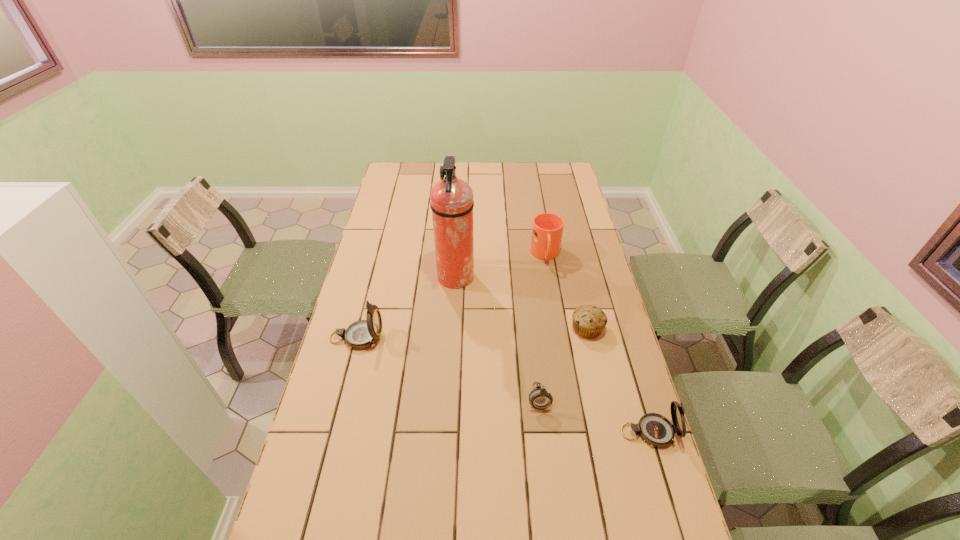
This screenshot has height=540, width=960. In the image, there is a desktop. Identify the location of vacant space at the left edge. (365, 250).

This screenshot has width=960, height=540. I want to click on vacant space at the right edge of the desktop, so click(571, 199).

This screenshot has height=540, width=960. Find the location of `free space at the far left corner of the desktop`. free space at the far left corner of the desktop is located at coordinates (397, 174).

At what (x,y) coordinates should I click in order to perform the action: click on vacant space at the far right corner of the desktop. Please return your answer as a coordinate pair (x, y). Image resolution: width=960 pixels, height=540 pixels. Looking at the image, I should click on (559, 172).

Image resolution: width=960 pixels, height=540 pixels. I want to click on blank region between the fifth object from right to left and the second nearest object, so click(x=497, y=338).

The width and height of the screenshot is (960, 540). In order to click on free space between the fire extinguisher and the second shortest compass in this screenshot , I will do `click(552, 355)`.

Where is `free spot between the muffin and the second shortest compass`? The image size is (960, 540). free spot between the muffin and the second shortest compass is located at coordinates (618, 380).

Where is `vacant space in between the leftmost object and the muffin`? vacant space in between the leftmost object and the muffin is located at coordinates (472, 333).

Image resolution: width=960 pixels, height=540 pixels. I want to click on unoccupied position between the second nearest compass and the mug, so click(x=542, y=326).

This screenshot has width=960, height=540. What are the coordinates of `unoccupied position between the tallest object and the muffin` in the screenshot? It's located at (521, 303).